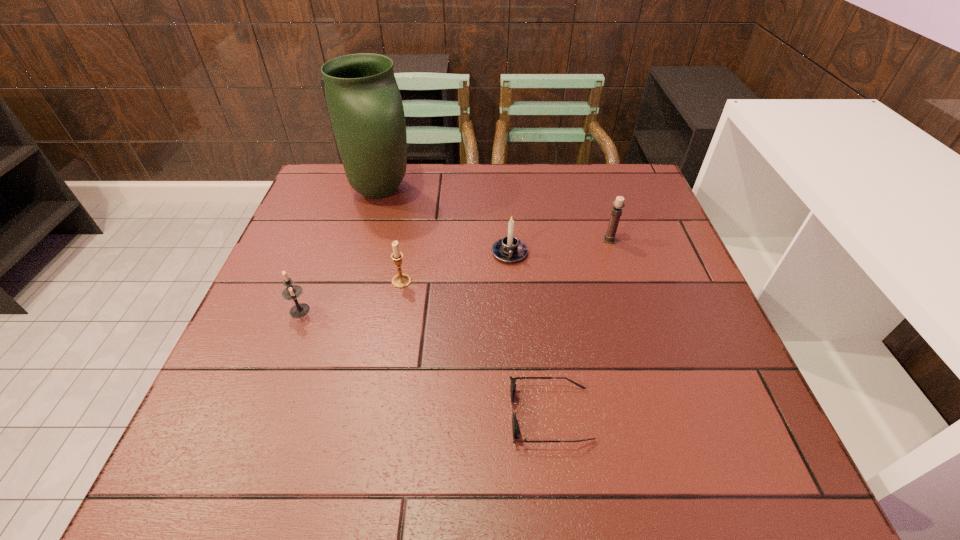
Identify the location of the farthest object. (365, 107).

Image resolution: width=960 pixels, height=540 pixels. I want to click on the tallest object, so click(365, 107).

Locate an element on the screen. the rightmost candle holder is located at coordinates (618, 204).

Where is `the third nearest object`? Image resolution: width=960 pixels, height=540 pixels. the third nearest object is located at coordinates (401, 280).

At what (x,y) coordinates should I click in order to perform the action: click on the third candle holder from right to left. Please return your answer as a coordinate pair (x, y). The image size is (960, 540). Looking at the image, I should click on (401, 280).

Where is `the third candle holder from left to right`? This screenshot has width=960, height=540. the third candle holder from left to right is located at coordinates (509, 249).

Identify the location of the fifth farthest object. The height and width of the screenshot is (540, 960). coord(292,292).

The height and width of the screenshot is (540, 960). In order to click on the leftmost candle holder in this screenshot , I will do `click(292, 292)`.

Locate an element on the screen. Image resolution: width=960 pixels, height=540 pixels. the shortest object is located at coordinates (515, 425).

At what (x,y) coordinates should I click in order to perform the action: click on the nearest object. Please return your answer as a coordinate pair (x, y). Looking at the image, I should click on (515, 425).